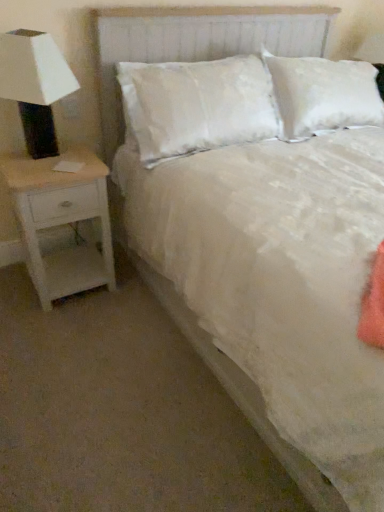
You are a GUI agent. You are given a task and a screenshot of the screen. Output one action in this format:
    pyautogui.click(x=<x>, y=<y>)
    Task: Click on the free space on the front side of white wood nightstand at left
    This screenshot has width=384, height=512.
    Given the screenshot: What is the action you would take?
    pos(66,329)